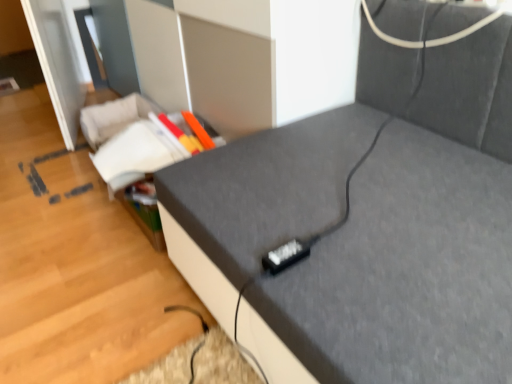
This screenshot has height=384, width=512. Describe the element at coordinates (367, 224) in the screenshot. I see `gray fabric couch at center` at that location.

Locate an element on the screen. gray fabric couch at center is located at coordinates (367, 224).

Locate an element on the screen. The height and width of the screenshot is (384, 512). gray fabric couch at center is located at coordinates (367, 224).